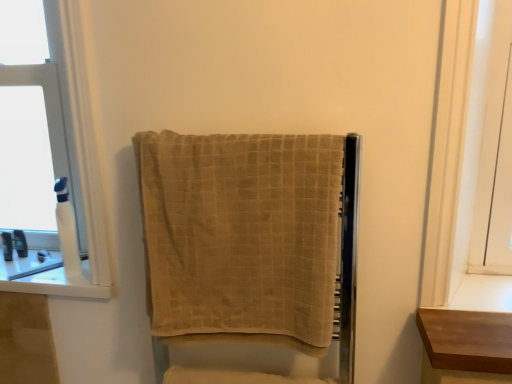
Question: Does translucent plastic bottle at left, which ranks as the 3th toiletry in front-to-back order, have a lesser height compared to beige textured towel at center?

Choices:
 (A) no
 (B) yes

Answer: (B)

Question: From a real-world perspective, is translucent plastic bottle at left, which ranks as the 3th toiletry in front-to-back order, located beneath beige textured towel at center?

Choices:
 (A) no
 (B) yes

Answer: (B)

Question: From the image's perspective, is translucent plastic bottle at left, which ranks as the 3th toiletry in front-to-back order, below beige textured towel at center?

Choices:
 (A) no
 (B) yes

Answer: (B)

Question: From a real-world perspective, is translucent plastic bottle at left, which ranks as the 3th toiletry in front-to-back order, positioned over beige textured towel at center based on gravity?

Choices:
 (A) yes
 (B) no

Answer: (B)

Question: Is translucent plastic bottle at left, acting as the first toiletry starting from the back, positioned before beige textured towel at center?

Choices:
 (A) no
 (B) yes

Answer: (A)

Question: From the image's perspective, is translucent plastic bottle at left, acting as the first toiletry starting from the back, above beige textured towel at center?

Choices:
 (A) no
 (B) yes

Answer: (A)

Question: From a real-world perspective, is white plastic bottle at left positioned under light brown wood shelf at right based on gravity?

Choices:
 (A) no
 (B) yes

Answer: (A)

Question: Does white plastic bottle at left lie behind light brown wood shelf at right?

Choices:
 (A) no
 (B) yes

Answer: (B)

Question: Can you confirm if white plastic bottle at left is bigger than light brown wood shelf at right?

Choices:
 (A) yes
 (B) no

Answer: (A)

Question: Does white plastic bottle at left come in front of light brown wood shelf at right?

Choices:
 (A) yes
 (B) no

Answer: (B)

Question: From the image's perspective, is white plastic bottle at left over light brown wood shelf at right?

Choices:
 (A) yes
 (B) no

Answer: (A)

Question: From a real-world perspective, does white plastic bottle at left stand above light brown wood shelf at right?

Choices:
 (A) yes
 (B) no

Answer: (A)

Question: Is white glossy window sill at left not within white plastic bottle at left, acting as the first toiletry starting from the right?

Choices:
 (A) no
 (B) yes

Answer: (B)